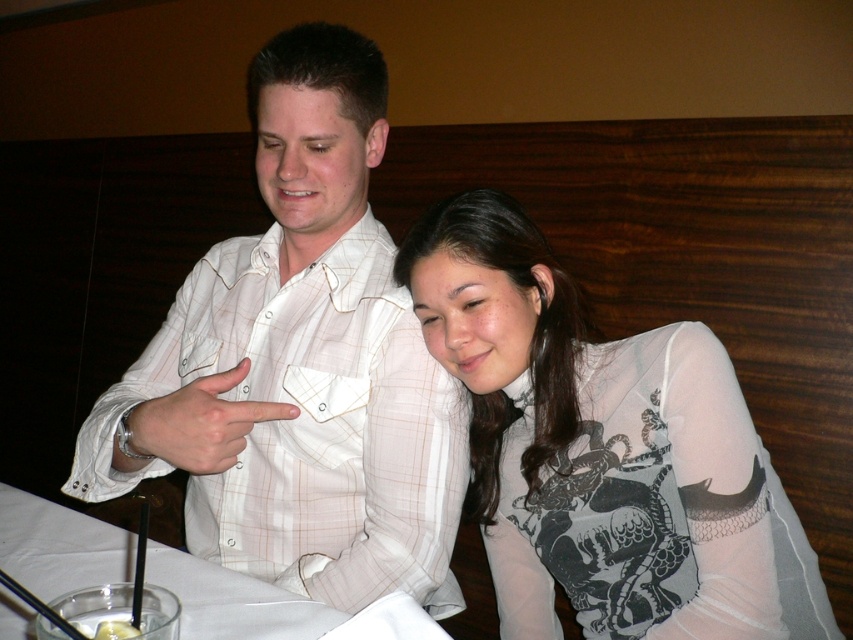
Is white checkered shirt at center closer to the viewer compared to sheer white blouse at center?

Yes, it is.

Is white checkered shirt at center taller than sheer white blouse at center?

Indeed, white checkered shirt at center has a greater height compared to sheer white blouse at center.

This screenshot has height=640, width=853. What do you see at coordinates (300, 365) in the screenshot?
I see `white checkered shirt at center` at bounding box center [300, 365].

At what (x,y) coordinates should I click in order to perform the action: click on white checkered shirt at center. Please return your answer as a coordinate pair (x, y). Image resolution: width=853 pixels, height=640 pixels. Looking at the image, I should click on (300, 365).

Between point (463, 208) and point (210, 449), which one is positioned behind?

Positioned behind is point (463, 208).

Can you confirm if sheer white blouse at center is positioned to the left of white matte finger at center?

In fact, sheer white blouse at center is to the right of white matte finger at center.

Is point (618, 522) in front of point (167, 452)?

No.

Image resolution: width=853 pixels, height=640 pixels. Identify the location of sheer white blouse at center. (602, 449).

Can you confirm if white checkered shirt at center is smaller than white matte finger at center?

No.

Is white checkered shirt at center taller than white matte finger at center?

Correct, white checkered shirt at center is much taller as white matte finger at center.

I want to click on white checkered shirt at center, so click(300, 365).